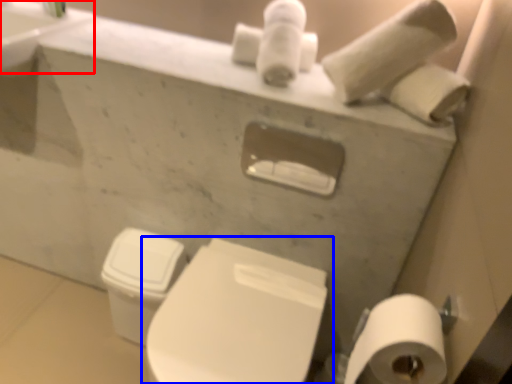
Question: Which of the following is the farthest to the observer, sink (highlighted by a red box) or toilet (highlighted by a blue box)?

Choices:
 (A) sink
 (B) toilet

Answer: (A)